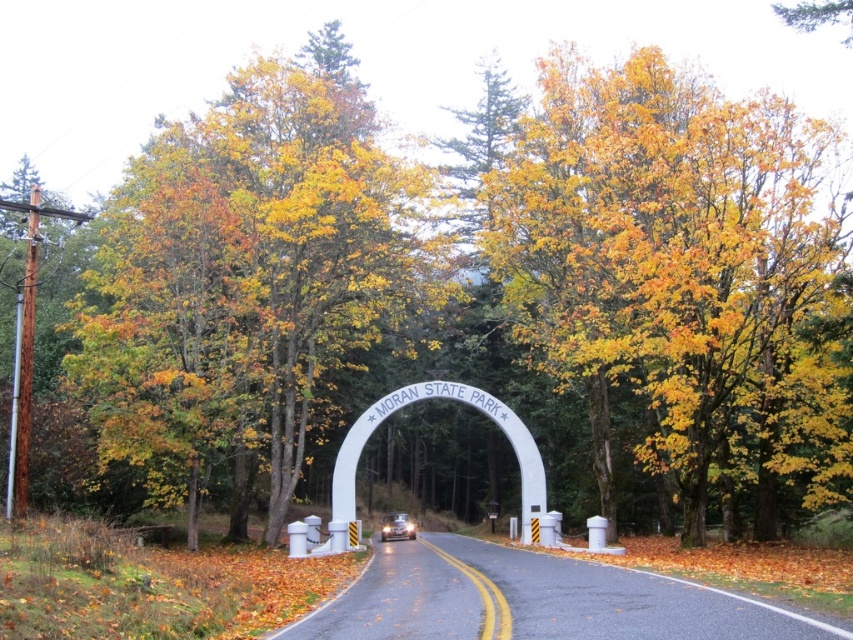
In the scene shown: Can you confirm if white concrete archway at center is positioned to the right of metallic silver car at center?

Indeed, white concrete archway at center is positioned on the right side of metallic silver car at center.

You are a GUI agent. You are given a task and a screenshot of the screen. Output one action in this format:
    pyautogui.click(x=<x>, y=<y>)
    Task: Click on the white concrete archway at center
    This screenshot has height=640, width=853.
    Given the screenshot: What is the action you would take?
    pyautogui.click(x=450, y=397)

Image resolution: width=853 pixels, height=640 pixels. Find the location of `white concrete archway at center`. white concrete archway at center is located at coordinates (450, 397).

You are a GUI agent. You are given a task and a screenshot of the screen. Output one action in this format:
    pyautogui.click(x=<x>, y=<y>)
    Task: Click on the white concrete archway at center
    
    Given the screenshot: What is the action you would take?
    pyautogui.click(x=450, y=397)

Between point (544, 224) and point (294, 348), which one is positioned in front?

Positioned in front is point (544, 224).

Does yellow leafy tree at center have a lesser width compared to yellow-green foliage at center?

Correct, yellow leafy tree at center's width is less than yellow-green foliage at center's.

Measure the distance between yellow leafy tree at center and camera.

20.91 meters

Locate an element on the screen. yellow leafy tree at center is located at coordinates (682, 268).

Which is behind, point (125, 186) or point (486, 394)?

Point (125, 186)

Who is positioned more to the left, yellow-green foliage at center or white concrete archway at center?

yellow-green foliage at center is more to the left.

The height and width of the screenshot is (640, 853). I want to click on yellow-green foliage at center, so (254, 276).